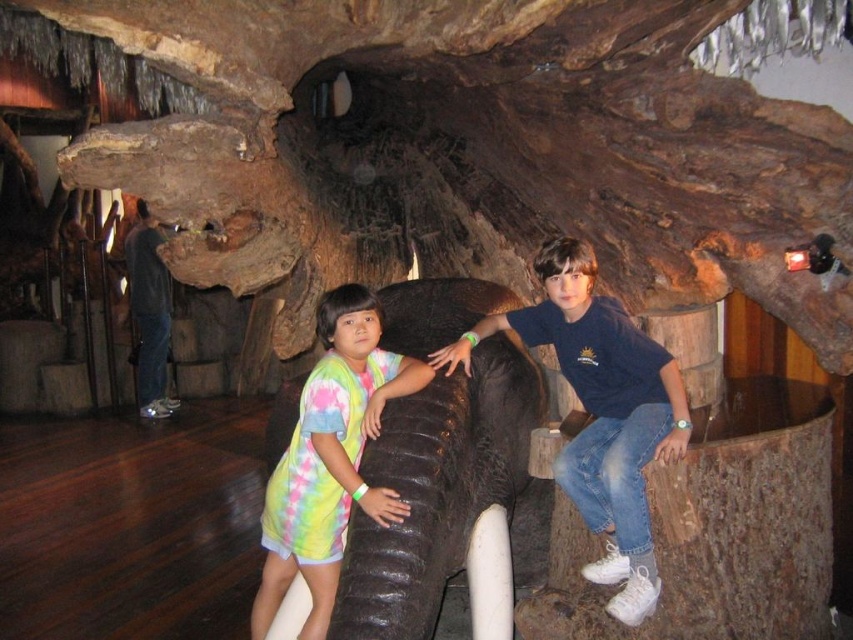
Does blue cotton shirt at center have a lesser height compared to tie-dye fabric shirt at center?

Indeed, blue cotton shirt at center has a lesser height compared to tie-dye fabric shirt at center.

Does blue cotton shirt at center appear under tie-dye fabric shirt at center?

No, blue cotton shirt at center is not below tie-dye fabric shirt at center.

This screenshot has width=853, height=640. Identify the location of blue cotton shirt at center. (601, 412).